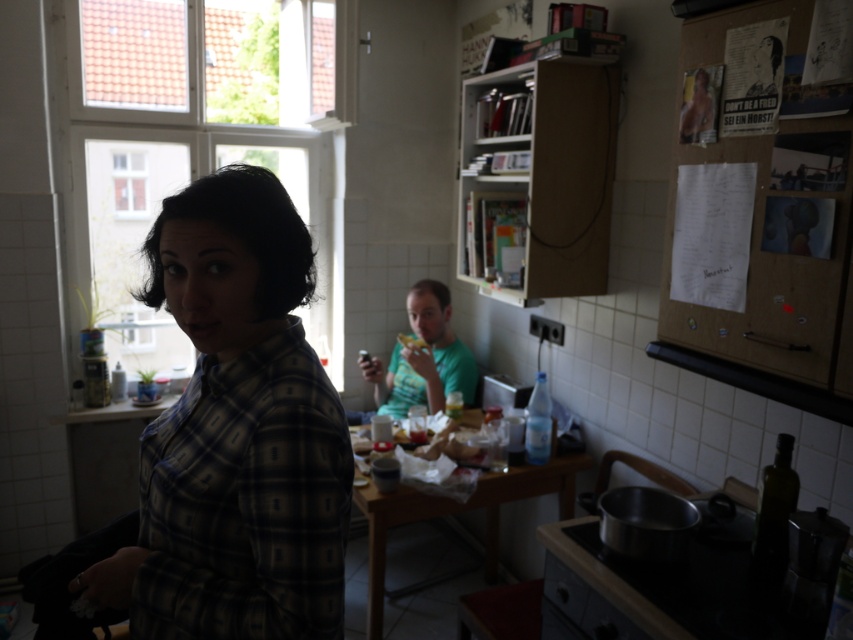
What are the coordinates of the plaid shirt at center?

The plaid shirt at center is located at coordinates point (235, 433).

You are standing at the entrance of the room and want to locate the green matte shirt at center. According to the coordinates provided, in which direction should you look relative to the center of the image?

The green matte shirt at center is located at point (422,356), which is slightly to the right and just below the center of the image. Therefore, you should look slightly to the right and a bit downward from the center to find it.